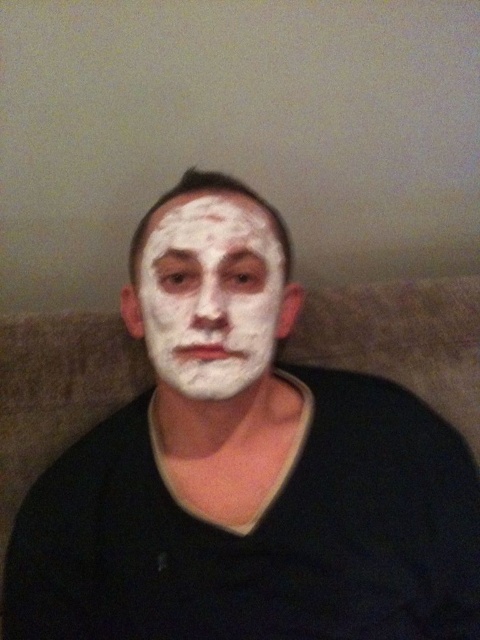
You are a makeup artist preparing to apply the white matte face paint at center to a client. The client is seated 19.70 inches away from you. If your reach is 22 inches, can you comfortably apply the makeup without moving your chair?

The client is seated 19.70 inches away from you, so yes, you can comfortably apply the makeup without moving your chair since your reach of 22 inches exceeds the distance between you and the client.

Based on the photo, you are a makeup artist preparing for a client. You have two options for covering their face in white matte material. The first is the white matte face paint at center, and the second is the white matte facial mask at center. Which option will cover more area on the client?

The white matte face paint at center has a larger size compared to white matte facial mask at center, so it will cover more area on the client.

You are a makeup artist trying to determine which product to use for a client who wants a full face coverage. The client has a photo of the scene where both the white matte face paint at center and the white matte facial mask at center are visible. Which product covers more area vertically?

The white matte face paint at center has a greater height compared to the white matte facial mask at center, so it covers more area vertically.